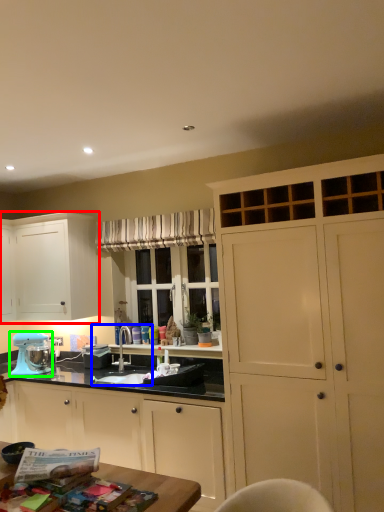
Question: Estimate the real-world distances between objects in this image. Which object is closer to cabinetry (highlighted by a red box), sink (highlighted by a blue box) or home appliance (highlighted by a green box)?

Choices:
 (A) sink
 (B) home appliance

Answer: (B)